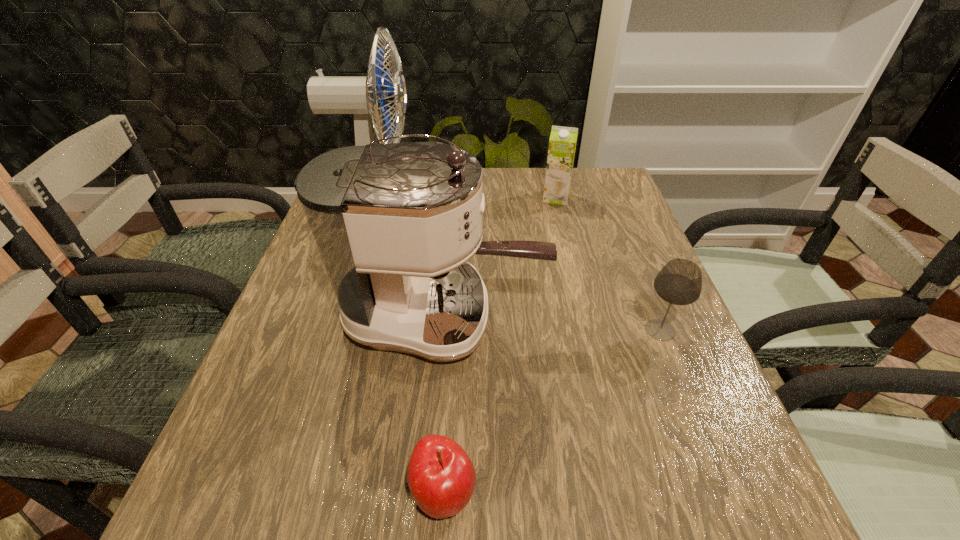
What are the coordinates of `fan` in the screenshot? It's located at (364, 96).

Where is `coffee maker`? coffee maker is located at coordinates (395, 224).

I want to click on the fourth object from left to right, so click(x=562, y=144).

Find the location of a particular element. soya milk is located at coordinates (562, 144).

The image size is (960, 540). Identify the location of wineglass. (679, 282).

Identify the location of the second shortest object. The image size is (960, 540). (679, 282).

Identify the location of apple. (441, 477).

Where is `the nearest object`? The height and width of the screenshot is (540, 960). the nearest object is located at coordinates (441, 477).

I want to click on free space located on the front-facing side of the fan, so click(x=464, y=195).

Locate an element on the screen. The height and width of the screenshot is (540, 960). vacant space located on the front-facing side of the coffee maker is located at coordinates (675, 317).